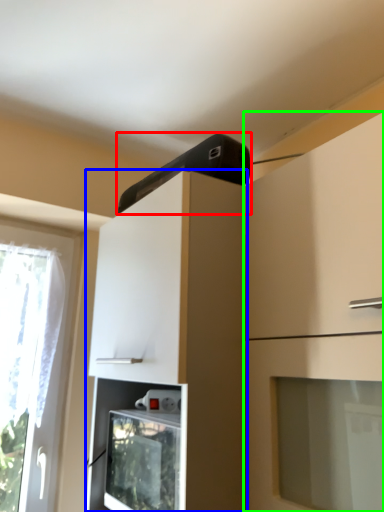
Question: Which is nearer to the appliance (highlighted by a red box)? cabinetry (highlighted by a blue box) or cabinetry (highlighted by a green box).

Choices:
 (A) cabinetry
 (B) cabinetry

Answer: (A)